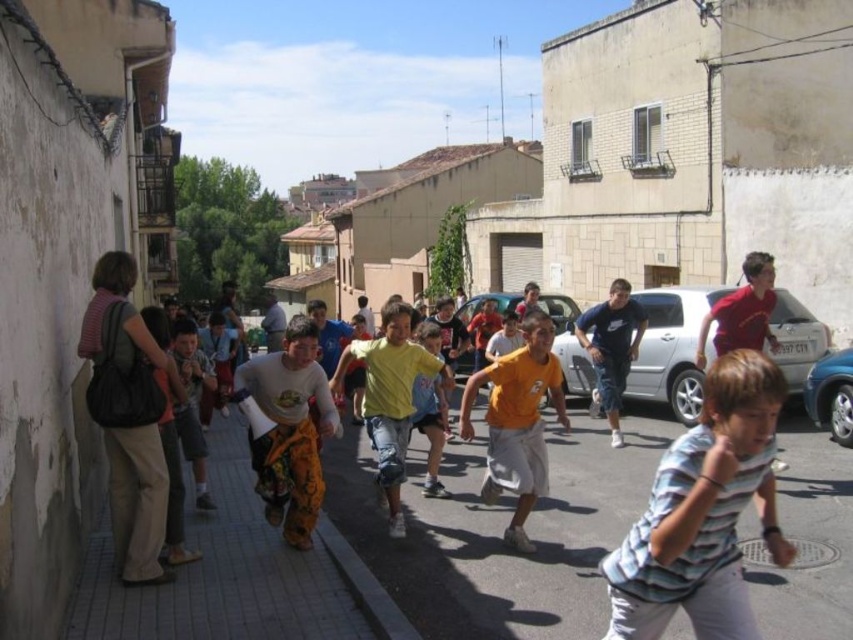
Is gray asphalt at center shorter than orange cotton shirt at center?

Correct, gray asphalt at center is not as tall as orange cotton shirt at center.

Is point (792, 612) behind point (500, 456)?

No, it is not.

Where is `gray asphalt at center`? The width and height of the screenshot is (853, 640). gray asphalt at center is located at coordinates (500, 531).

Does striped cotton shirt at center appear over orange cotton shirt at center?

Actually, striped cotton shirt at center is below orange cotton shirt at center.

Can you confirm if striped cotton shirt at center is positioned below orange cotton shirt at center?

Yes.

This screenshot has height=640, width=853. What do you see at coordinates (703, 513) in the screenshot? I see `striped cotton shirt at center` at bounding box center [703, 513].

Where is `striped cotton shirt at center`? This screenshot has height=640, width=853. striped cotton shirt at center is located at coordinates (703, 513).

Is gray asphalt at center bigger than brown brick pavement at lower left?

Actually, gray asphalt at center might be smaller than brown brick pavement at lower left.

In the scene shown: Who is taller, gray asphalt at center or brown brick pavement at lower left?

brown brick pavement at lower left is taller.

Between point (494, 620) and point (265, 572), which one is positioned in front?

Point (494, 620) is in front.

Identify the location of gray asphalt at center. (500, 531).